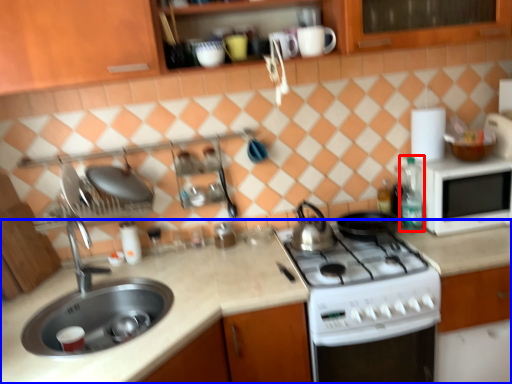
Question: Which point is further to the camera, bottle (highlighted by a red box) or countertop (highlighted by a blue box)?

Choices:
 (A) bottle
 (B) countertop

Answer: (A)